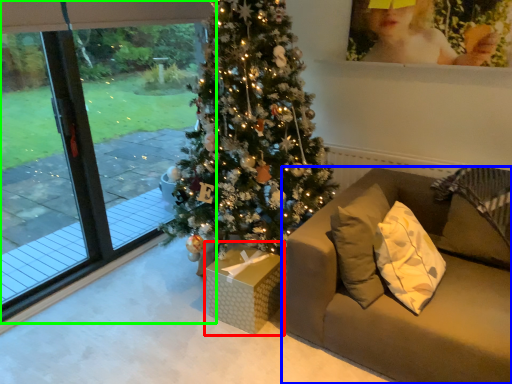
Question: Considering the real-world distances, which object is closest to furniture (highlighted by a red box)? studio couch (highlighted by a blue box) or window (highlighted by a green box).

Choices:
 (A) studio couch
 (B) window

Answer: (A)